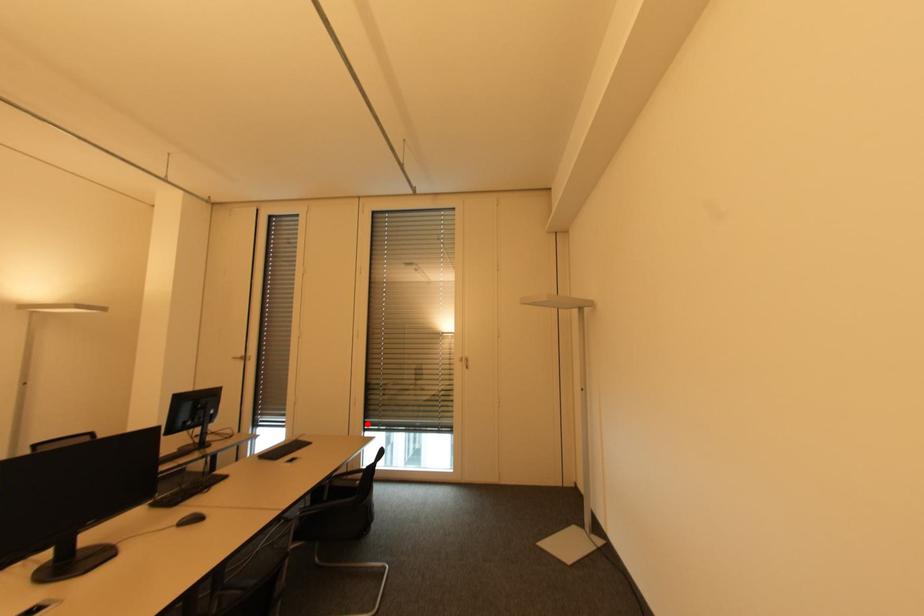
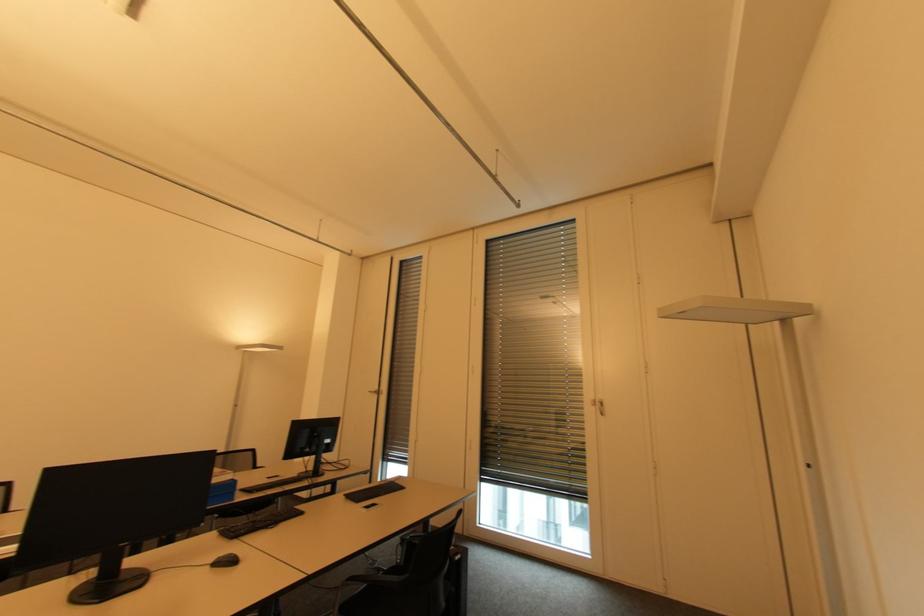
Question: I am providing you with two images of the same scene from different viewpoints. Image1 has a red point marked. In image2, the corresponding 3D location appears at what relative position? Reply with the corresponding letter.

Choices:
 (A) Closer
 (B) Farther

Answer: (A)